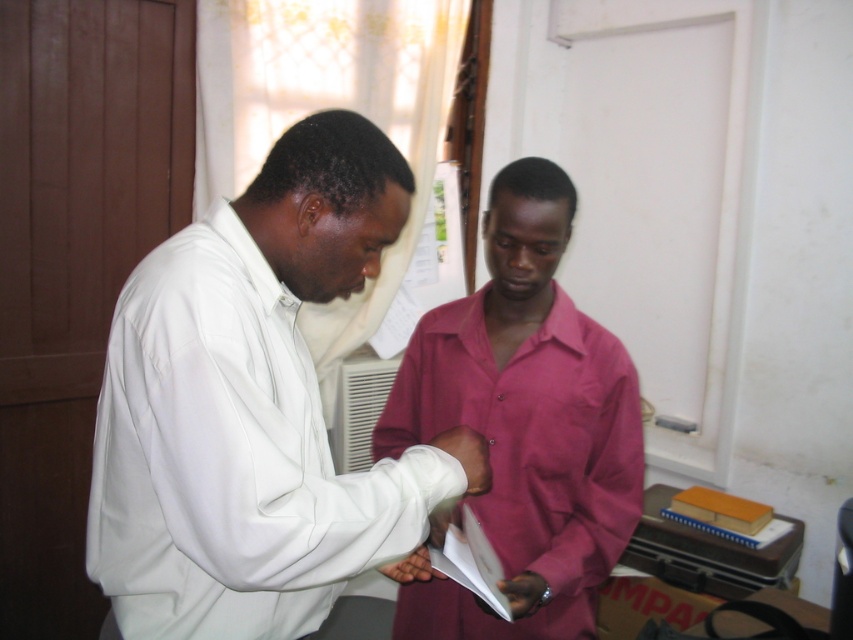
Describe the element at coordinates (471, 561) in the screenshot. I see `white paper at center` at that location.

Image resolution: width=853 pixels, height=640 pixels. In order to click on white paper at center in this screenshot , I will do `click(471, 561)`.

The image size is (853, 640). Identify the location of white paper at center. (471, 561).

Between point (543, 461) and point (712, 516), which one is positioned behind?

Positioned behind is point (712, 516).

Consider the image. Does matte pink shirt at center appear on the right side of yellow matte folder at lower right?

In fact, matte pink shirt at center is to the left of yellow matte folder at lower right.

This screenshot has height=640, width=853. Find the location of `matte pink shirt at center`. matte pink shirt at center is located at coordinates (525, 460).

Consider the image. Does white smooth shirt at center appear on the left side of yellow matte folder at lower right?

Correct, you'll find white smooth shirt at center to the left of yellow matte folder at lower right.

Which is above, white smooth shirt at center or yellow matte folder at lower right?

white smooth shirt at center is higher up.

Is point (265, 580) more distant than point (723, 522)?

No, (265, 580) is closer to viewer.

Where is `white smooth shirt at center`? This screenshot has width=853, height=640. white smooth shirt at center is located at coordinates (254, 406).